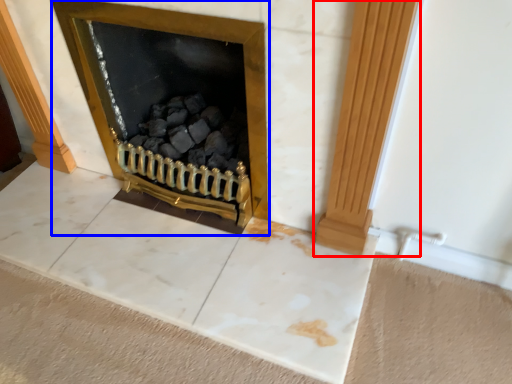
Question: Which object is closer to the camera taking this photo, pillar (highlighted by a red box) or fireplace (highlighted by a blue box)?

Choices:
 (A) pillar
 (B) fireplace

Answer: (A)